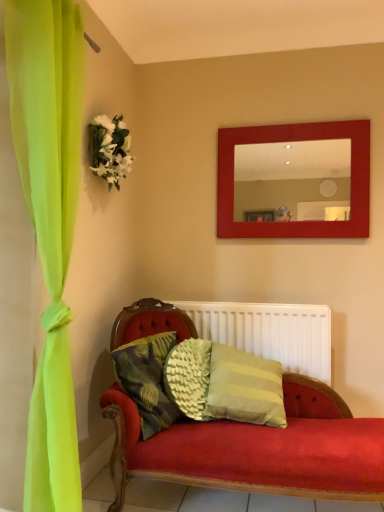
Question: Is textured green pillow at center aimed at matte red mirror at upper center?

Choices:
 (A) no
 (B) yes

Answer: (A)

Question: Is textured green pillow at center further to camera compared to matte red mirror at upper center?

Choices:
 (A) yes
 (B) no

Answer: (B)

Question: Is textured green pillow at center with matte red mirror at upper center?

Choices:
 (A) yes
 (B) no

Answer: (B)

Question: From a real-world perspective, is textured green pillow at center over matte red mirror at upper center?

Choices:
 (A) no
 (B) yes

Answer: (A)

Question: Can you confirm if textured green pillow at center is bigger than matte red mirror at upper center?

Choices:
 (A) yes
 (B) no

Answer: (B)

Question: Looking at their shapes, would you say textured green pillow at center is wider or thinner than white matte radiator at center?

Choices:
 (A) thin
 (B) wide

Answer: (B)

Question: From a real-world perspective, relative to white matte radiator at center, is textured green pillow at center vertically above or below?

Choices:
 (A) below
 (B) above

Answer: (A)

Question: Do you think textured green pillow at center is within white matte radiator at center, or outside of it?

Choices:
 (A) inside
 (B) outside

Answer: (B)

Question: Is textured green pillow at center in front of or behind white matte radiator at center in the image?

Choices:
 (A) behind
 (B) front

Answer: (B)

Question: Based on their sizes in the image, would you say white matte radiator at center is bigger or smaller than matte red mirror at upper center?

Choices:
 (A) big
 (B) small

Answer: (A)

Question: Considering the positions of white matte radiator at center and matte red mirror at upper center in the image, is white matte radiator at center wider or thinner than matte red mirror at upper center?

Choices:
 (A) thin
 (B) wide

Answer: (B)

Question: Is point (249, 309) closer or farther from the camera than point (253, 196)?

Choices:
 (A) closer
 (B) farther

Answer: (A)

Question: Would you say white matte radiator at center is to the left or to the right of matte red mirror at upper center in the picture?

Choices:
 (A) right
 (B) left

Answer: (B)

Question: Is white silk flowers at upper left in front of or behind matte red mirror at upper center in the image?

Choices:
 (A) behind
 (B) front

Answer: (B)

Question: Is white silk flowers at upper left inside the boundaries of matte red mirror at upper center, or outside?

Choices:
 (A) outside
 (B) inside

Answer: (A)